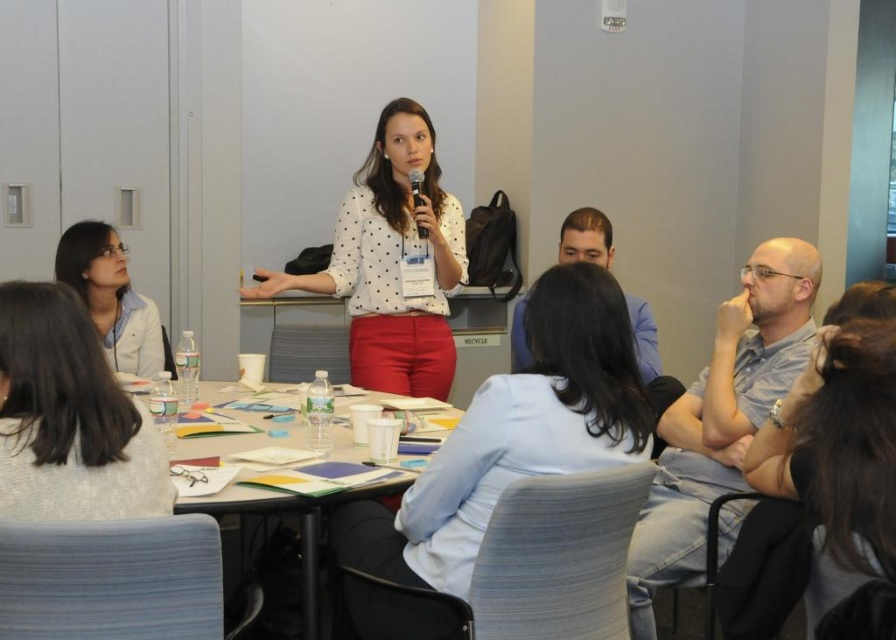
You are sitting at the conference table and want to reach two points marked on the floor. The first point is at coordinate point[92,518] and the second is at point[380,211]. Which point is closer to you?

The point at coordinate point[92,518] is closer to you than the point at point[380,211].

You are organizing a photo shoot and need to ensure that the gray knit sweater at lower left and the white dotted shirt at center are both visible in the frame. Given their sizes, which one might require more careful positioning to avoid being obscured by other objects on the table?

The gray knit sweater at lower left has a lesser width compared to the white dotted shirt at center, so it might require more careful positioning to avoid being obscured by other objects on the table due to its smaller size.

You are organizing a small workshop and need to place a 1.2 meter wide whiteboard on the table. Given the black plastic table at center and the matte black microphone at center, can the whiteboard fit on the table?

The black plastic table at center has a width larger than the matte black microphone at center. Since the microphone is likely smaller than the table, the whiteboard might fit, but the exact dimensions aren